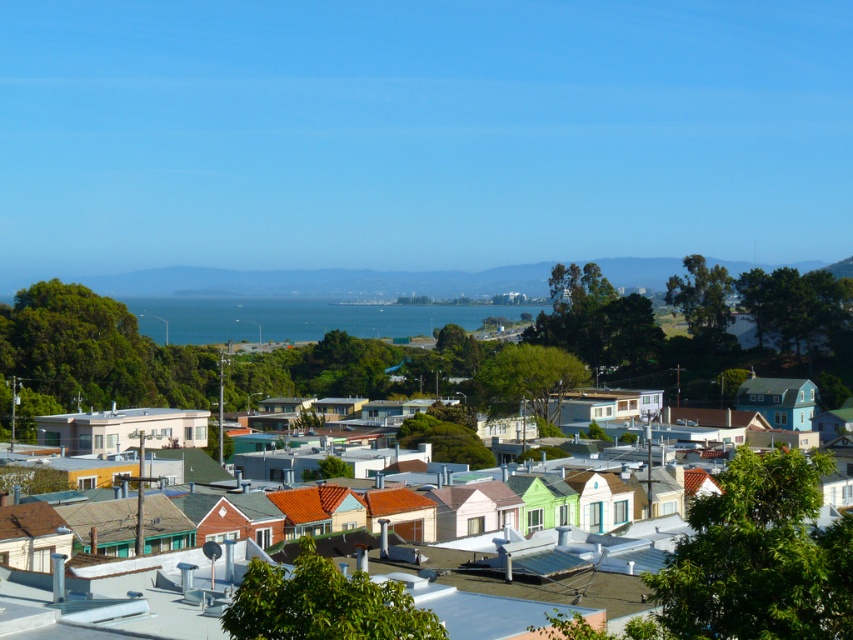
Can you confirm if multicolored rooftops at center is positioned above blue water at center?

Actually, multicolored rooftops at center is below blue water at center.

Describe the element at coordinates (91, 356) in the screenshot. I see `multicolored rooftops at center` at that location.

What do you see at coordinates (91, 356) in the screenshot? This screenshot has height=640, width=853. I see `multicolored rooftops at center` at bounding box center [91, 356].

Image resolution: width=853 pixels, height=640 pixels. Identify the location of multicolored rooftops at center. (91, 356).